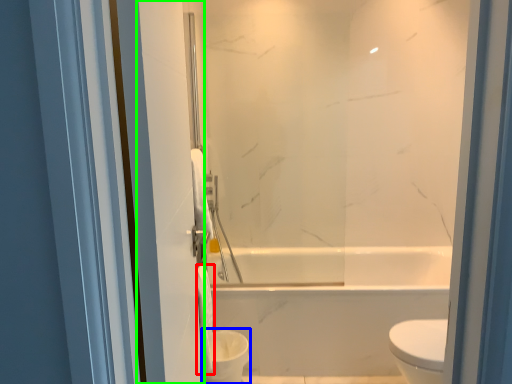
Question: Considering the real-world distances, which object is farthest from toilet paper (highlighted by a red box)? toilet bowl (highlighted by a blue box) or screen door (highlighted by a green box)?

Choices:
 (A) toilet bowl
 (B) screen door

Answer: (B)